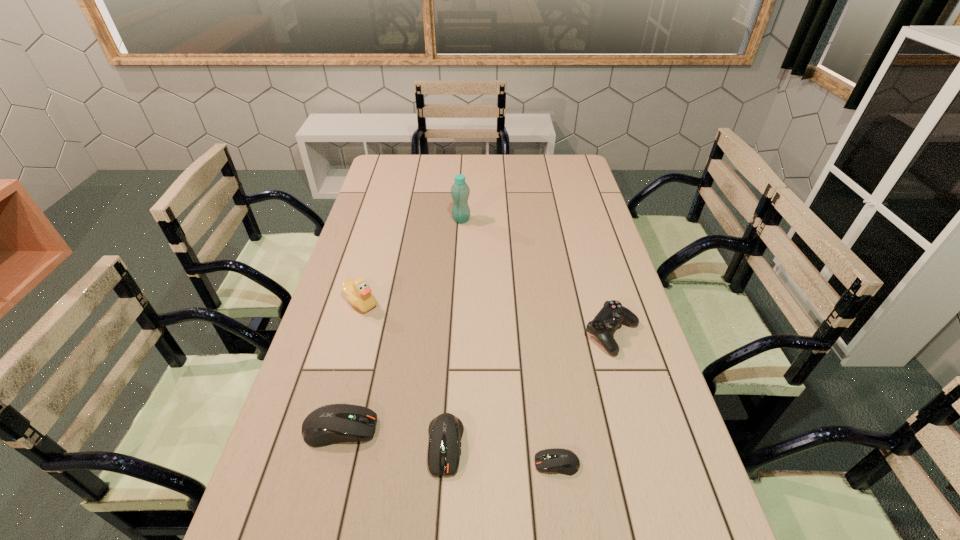
The width and height of the screenshot is (960, 540). Find the location of `the leftmost computer equipment`. the leftmost computer equipment is located at coordinates (330, 424).

Find the location of a particular element. This screenshot has height=540, width=960. the fifth tallest object is located at coordinates pyautogui.click(x=445, y=431).

Locate an element on the screen. This screenshot has width=960, height=540. the second tallest computer equipment is located at coordinates tap(445, 431).

Locate an element on the screen. the shortest object is located at coordinates (559, 460).

Identify the location of the shortest computer equipment. Image resolution: width=960 pixels, height=540 pixels. (559, 460).

At what (x,y) coordinates should I click in order to perform the action: click on water bottle. Please return your answer as a coordinate pair (x, y). The height and width of the screenshot is (540, 960). Looking at the image, I should click on (460, 191).

Where is `the farthest object`? This screenshot has height=540, width=960. the farthest object is located at coordinates (460, 191).

Locate an element on the screen. the fifth shortest object is located at coordinates (359, 294).

Locate an element on the screen. The height and width of the screenshot is (540, 960). the fourth shortest object is located at coordinates (605, 323).

At what (x,y) coordinates should I click in order to perform the action: click on control. Please return your answer as a coordinate pair (x, y). Looking at the image, I should click on (605, 323).